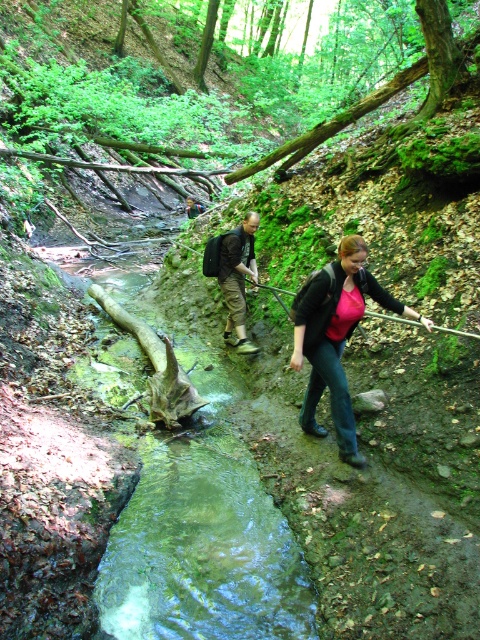
You are planning to take a photo of the matte black jacket at center and the dark brown leather backpack at center in the forest scene. Which object should you zoom in on if you want to capture more details of the larger one?

The matte black jacket at center is larger than the dark brown leather backpack at center, so you should zoom in on the matte black jacket at center to capture more details of the larger one.

You are a photographer standing at the edge of the forest scene. You want to take a photo that includes both the point at coordinates point(393,307) and point(231,282). Which point will appear larger in your photo?

Point(393,307) is closer to the camera than point(231,282), so it will appear larger in the photo.